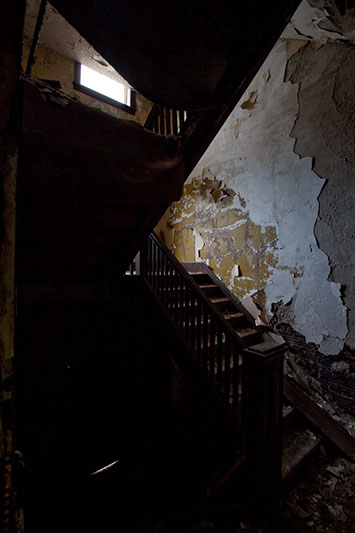
The height and width of the screenshot is (533, 355). Identify the location of yellow walls. (236, 233).